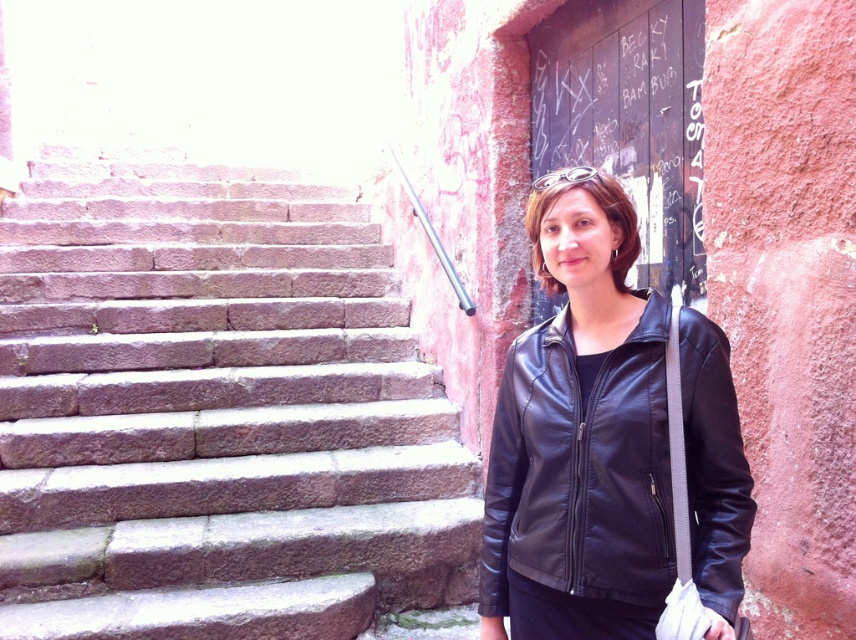
Who is taller, brown stone stairs at left or black leather jacket at right?

Standing taller between the two is brown stone stairs at left.

This screenshot has height=640, width=856. Describe the element at coordinates (215, 413) in the screenshot. I see `brown stone stairs at left` at that location.

The image size is (856, 640). I want to click on brown stone stairs at left, so click(215, 413).